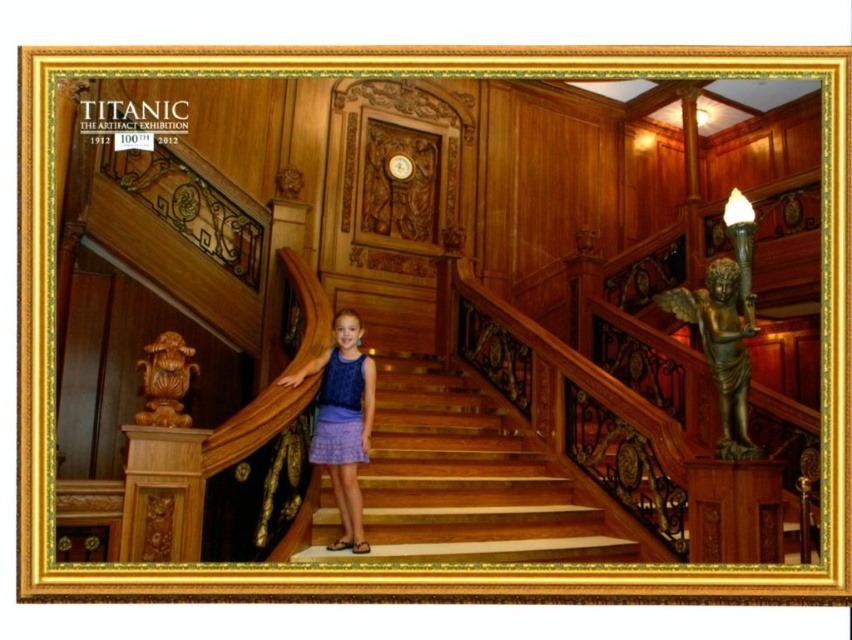
Does wooden stairs at center appear on the right side of lavender fabric skirt at center?

Indeed, wooden stairs at center is positioned on the right side of lavender fabric skirt at center.

Who is positioned more to the right, wooden stairs at center or lavender fabric skirt at center?

From the viewer's perspective, wooden stairs at center appears more on the right side.

You are a GUI agent. You are given a task and a screenshot of the screen. Output one action in this format:
    pyautogui.click(x=<x>, y=<y>)
    Task: Click on the wooden stairs at center
    
    Given the screenshot: What is the action you would take?
    pyautogui.click(x=473, y=477)

The image size is (852, 640). Find the location of `wooden stairs at center`. wooden stairs at center is located at coordinates (473, 477).